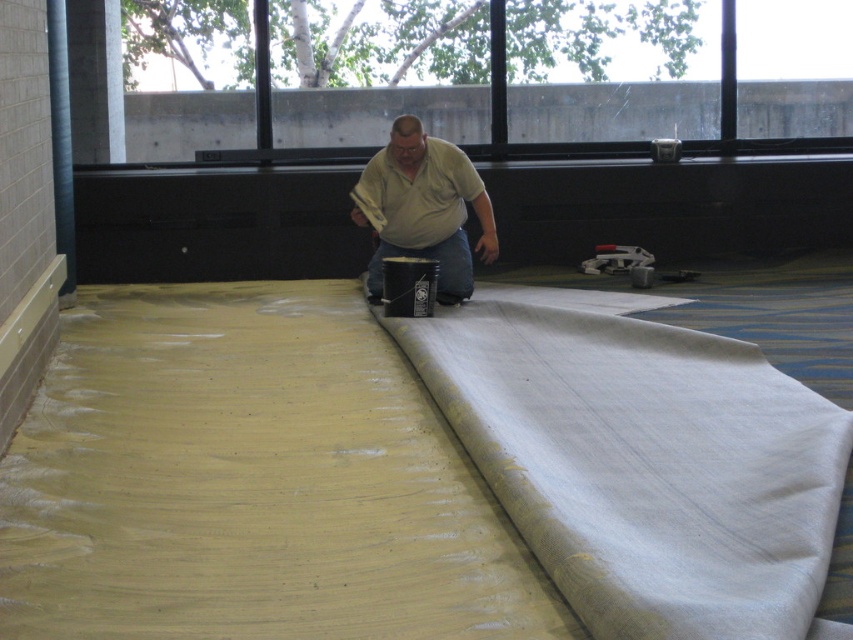
Question: Among these points, which one is farthest from the camera?

Choices:
 (A) (438, 200)
 (B) (416, 355)

Answer: (A)

Question: Is white fabric at center wider than matte beige shirt at center?

Choices:
 (A) no
 (B) yes

Answer: (B)

Question: Which point is farther from the camera taking this photo?

Choices:
 (A) (828, 442)
 (B) (437, 166)

Answer: (B)

Question: Which point is closer to the camera taking this photo?

Choices:
 (A) (445, 280)
 (B) (585, 557)

Answer: (B)

Question: Can you confirm if white fabric at center is thinner than matte beige shirt at center?

Choices:
 (A) no
 (B) yes

Answer: (A)

Question: Is white fabric at center smaller than matte beige shirt at center?

Choices:
 (A) yes
 (B) no

Answer: (B)